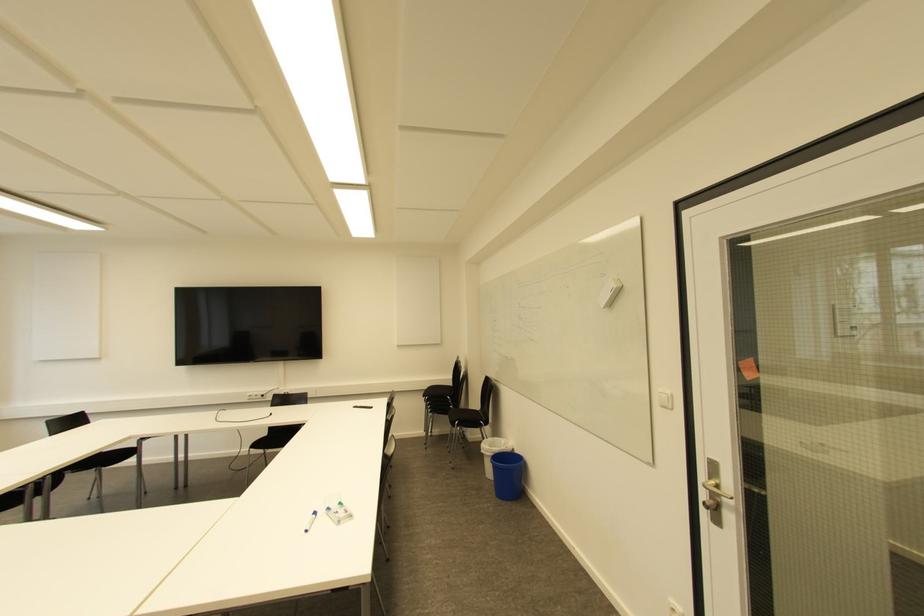
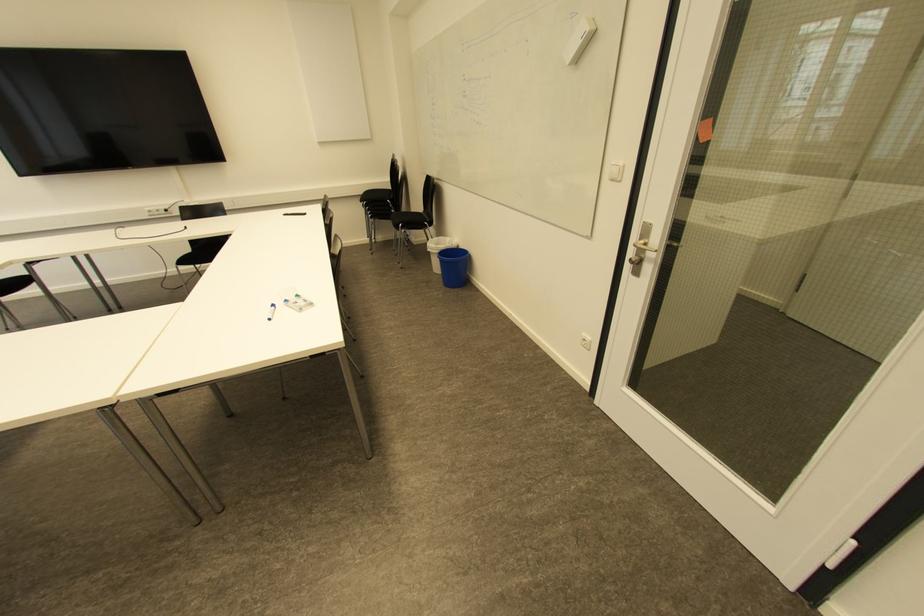
In the second image, find the point that corresponds to (489,447) in the first image.

(434, 245)